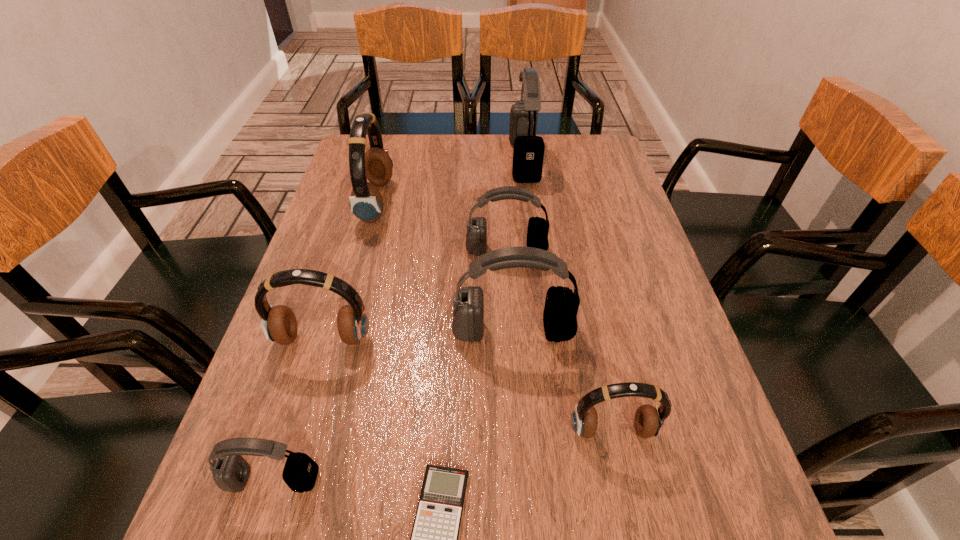
In order to click on black headset identified as the closest to the farthest brown headset in this screenshot , I will do `click(538, 228)`.

Identify the location of black headset identified as the closest to the second nearest black headset. (538, 228).

Identify which brown headset is the closest to the biggest brown headset. Please provide its 2D coordinates. Your answer should be formatted as a tuple, i.e. [(x, y)], where the tuple contains the x and y coordinates of a point satisfying the conditions above.

[(279, 324)]

Locate which brown headset is the closest to the second biggest black headset. Please provide its 2D coordinates. Your answer should be formatted as a tuple, i.e. [(x, y)], where the tuple contains the x and y coordinates of a point satisfying the conditions above.

[(649, 421)]